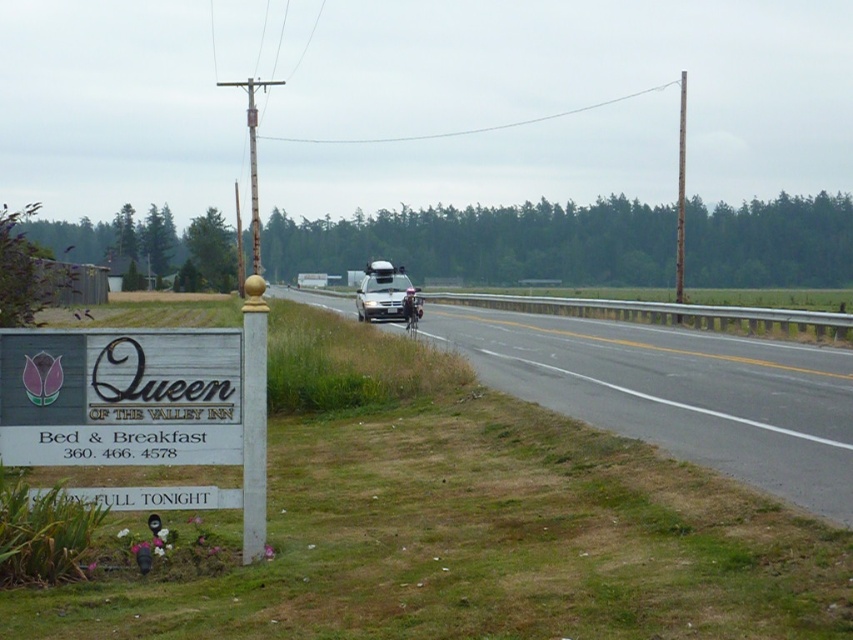
Does asphalt road at center appear on the right side of white matte van at center?

Correct, you'll find asphalt road at center to the right of white matte van at center.

Can you confirm if asphalt road at center is bigger than white matte van at center?

Actually, asphalt road at center might be smaller than white matte van at center.

What do you see at coordinates (677, 394) in the screenshot?
I see `asphalt road at center` at bounding box center [677, 394].

You are a GUI agent. You are given a task and a screenshot of the screen. Output one action in this format:
    pyautogui.click(x=<x>, y=<y>)
    Task: Click on the asphalt road at center
    
    Given the screenshot: What is the action you would take?
    pyautogui.click(x=677, y=394)

In the scene shown: Measure the distance between asphalt road at center and camera.

asphalt road at center is 8.62 meters from camera.

Consider the image. Is asphalt road at center to the left of brushed metal utility pole at upper center from the viewer's perspective?

Correct, you'll find asphalt road at center to the left of brushed metal utility pole at upper center.

Between point (569, 342) and point (683, 209), which one is positioned in front?

Point (569, 342)

Find the location of a particular element. Image resolution: width=853 pixels, height=640 pixels. asphalt road at center is located at coordinates (677, 394).

Which is more to the right, wooden signboard at lower left or brushed metal utility pole at upper center?

Positioned to the right is brushed metal utility pole at upper center.

Can you confirm if wooden signboard at lower left is bigger than brushed metal utility pole at upper center?

Actually, wooden signboard at lower left might be smaller than brushed metal utility pole at upper center.

The width and height of the screenshot is (853, 640). What are the coordinates of `wooden signboard at lower left` in the screenshot? It's located at (120, 396).

Where is `wooden signboard at lower left`? This screenshot has height=640, width=853. wooden signboard at lower left is located at coordinates (120, 396).